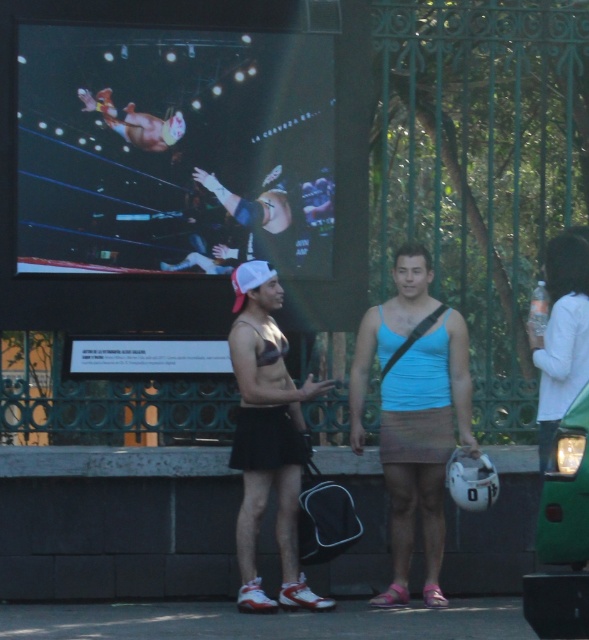
Can you confirm if matte black screen at upper center is thinner than white cotton shirt at right?

In fact, matte black screen at upper center might be wider than white cotton shirt at right.

Does matte black screen at upper center lie behind white cotton shirt at right?

Yes, matte black screen at upper center is further from the viewer.

Is point (260, 54) positioned behind point (554, 276)?

Yes, it is.

At what (x,y) coordinates should I click in order to perform the action: click on matte black screen at upper center. Please return your answer as a coordinate pair (x, y). Looking at the image, I should click on (180, 161).

Does light blue tank top at center have a smaller size compared to white cotton shirt at right?

Actually, light blue tank top at center might be larger than white cotton shirt at right.

Between light blue tank top at center and white cotton shirt at right, which one is positioned lower?

Positioned lower is light blue tank top at center.

What do you see at coordinates (413, 412) in the screenshot? I see `light blue tank top at center` at bounding box center [413, 412].

Image resolution: width=589 pixels, height=640 pixels. In order to click on light blue tank top at center in this screenshot , I will do `click(413, 412)`.

Between black matte shorts at center and white cotton shirt at right, which one has more height?

With more height is black matte shorts at center.

Is black matte shorts at center wider than white cotton shirt at right?

Indeed, black matte shorts at center has a greater width compared to white cotton shirt at right.

In order to click on black matte shorts at center in this screenshot , I will do `click(267, 436)`.

Where is `black matte shorts at center`? black matte shorts at center is located at coordinates (267, 436).